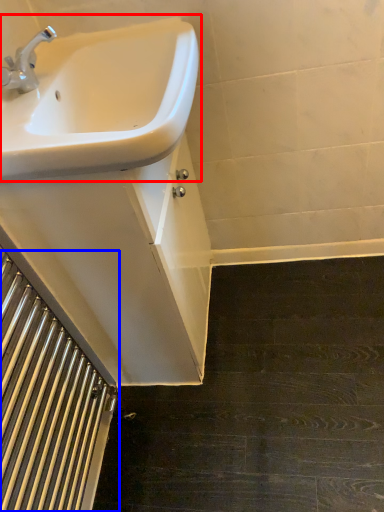
Question: Which point is further to the camera, sink (highlighted by a red box) or stairwell (highlighted by a blue box)?

Choices:
 (A) sink
 (B) stairwell

Answer: (A)